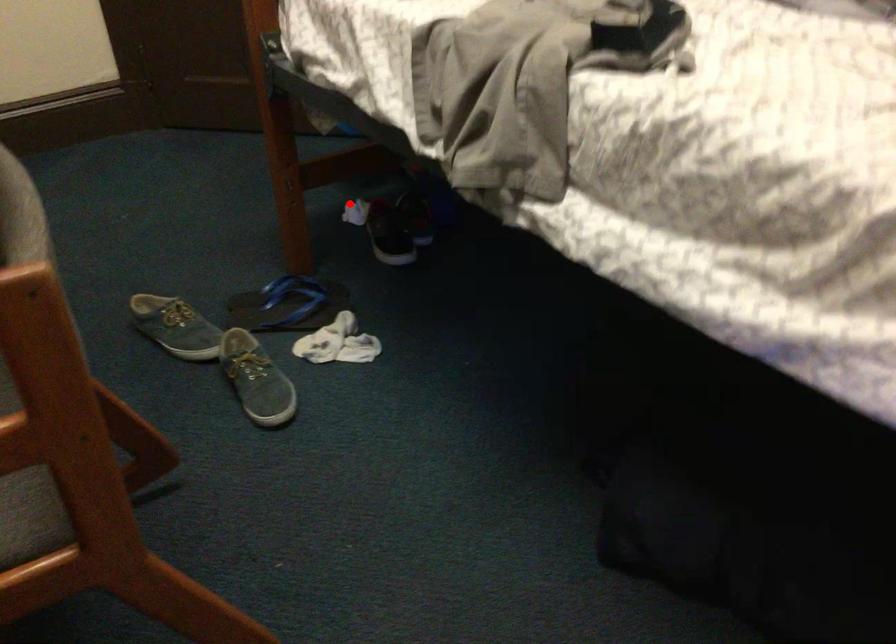
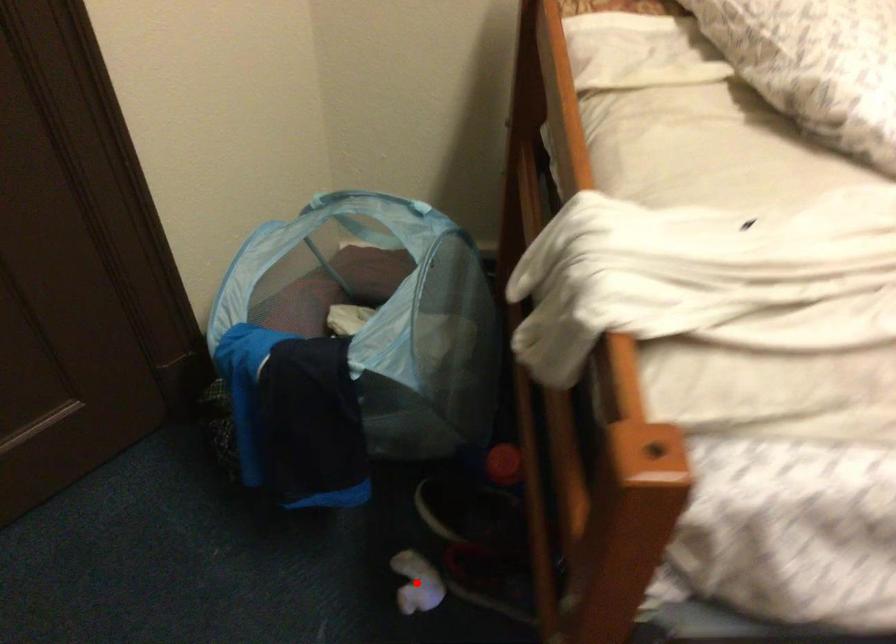
I am providing you with two images of the same scene from different viewpoints. A red point is marked on the first image and another point is marked on the second image. Does the point marked in image1 correspond to the same location as the one in image2?

Yes